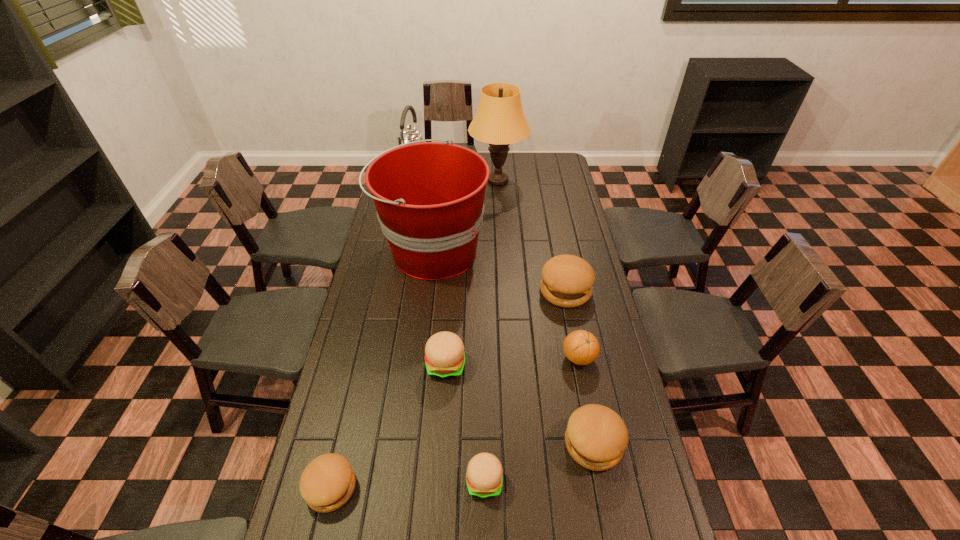
Find the location of a particular element. Image resolution: width=960 pixels, height=540 pixels. free space at the left edge is located at coordinates (352, 330).

In order to click on blank space at the right edge of the desktop in this screenshot , I will do `click(574, 248)`.

Identify the location of free space at the far right corner of the desktop. (565, 163).

Find the location of a particular element. The image size is (960, 540). vacant space that is in between the farthest brown hamburger and the leftmost hamburger is located at coordinates (448, 389).

Identify the location of vacant area between the red bucket and the farther beige hamburger. (440, 307).

Identify the location of free spot between the farthest brown hamburger and the kettle. (490, 232).

The width and height of the screenshot is (960, 540). I want to click on free space between the orange orange and the right beige hamburger, so click(x=532, y=419).

Where is `vacant area that lies between the orange orange and the lampshade`? The image size is (960, 540). vacant area that lies between the orange orange and the lampshade is located at coordinates (539, 269).

Identify the location of free space that is in between the orange orange and the biggest brown hamburger. This screenshot has width=960, height=540. (572, 324).

Identify the location of blank region between the bucket and the second farthest hamburger. This screenshot has height=540, width=960. click(440, 307).